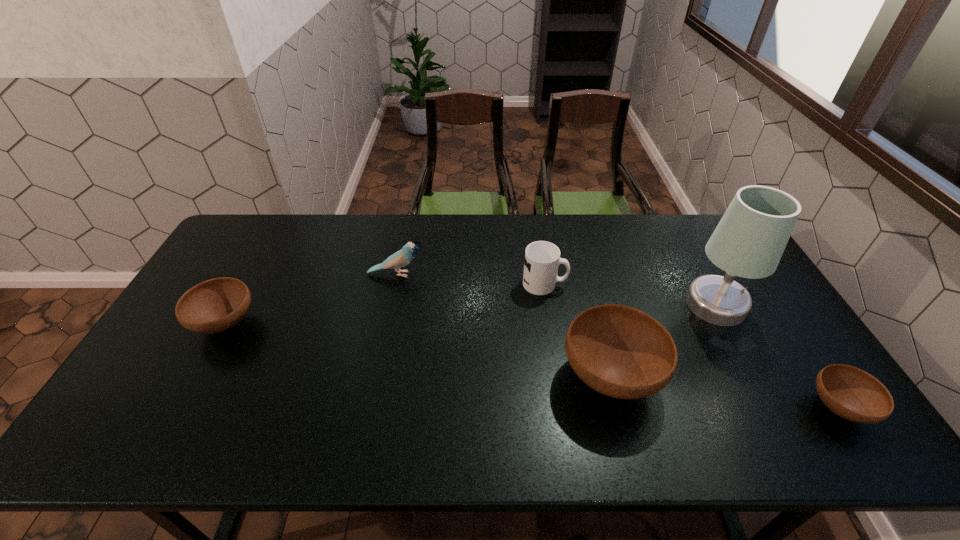
Find the location of a particular element. The height and width of the screenshot is (540, 960). free location that satisfies the following two spatial constraints: 1. on the back side of the second bowl from left to right; 2. on the handle side of the mug is located at coordinates (587, 284).

The height and width of the screenshot is (540, 960). I want to click on free spot that satisfies the following two spatial constraints: 1. on the handle side of the mug; 2. on the back side of the shortest bowl, so click(x=564, y=408).

Where is `vacant space that satisfies the following two spatial constraints: 1. on the handle side of the mug; 2. on the left side of the tallest bowl`? The image size is (960, 540). vacant space that satisfies the following two spatial constraints: 1. on the handle side of the mug; 2. on the left side of the tallest bowl is located at coordinates (559, 376).

This screenshot has height=540, width=960. In order to click on vacant space that satisfies the following two spatial constraints: 1. on the handle side of the mug; 2. on the back side of the rightmost bowl in this screenshot , I will do `click(564, 408)`.

I want to click on vacant position in the image that satisfies the following two spatial constraints: 1. on the front side of the rightmost bowl; 2. on the right side of the tallest bowl, so click(618, 408).

The height and width of the screenshot is (540, 960). Find the location of `free point that satisfies the following two spatial constraints: 1. on the front side of the fifth tallest object; 2. on the left side of the rightmost object`. free point that satisfies the following two spatial constraints: 1. on the front side of the fifth tallest object; 2. on the left side of the rightmost object is located at coordinates (179, 408).